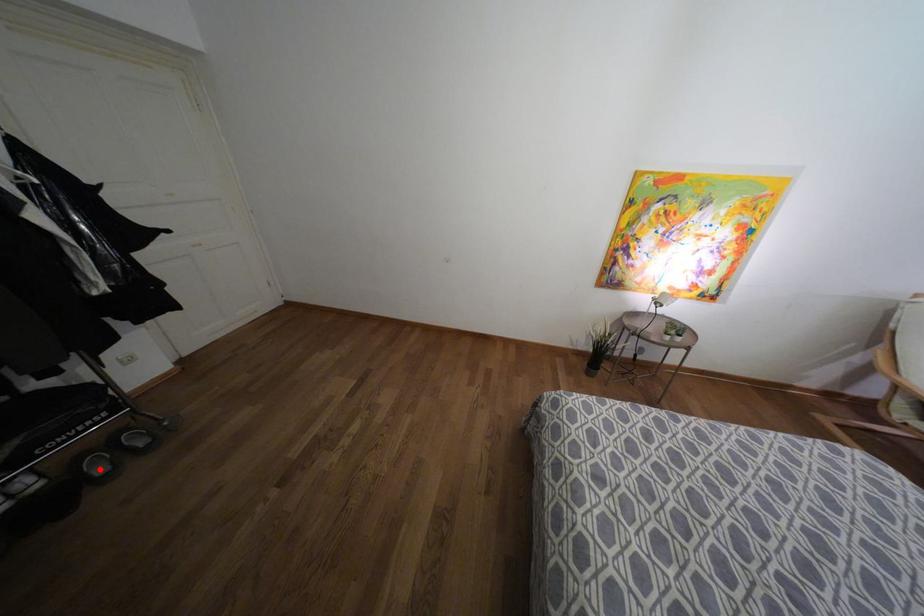
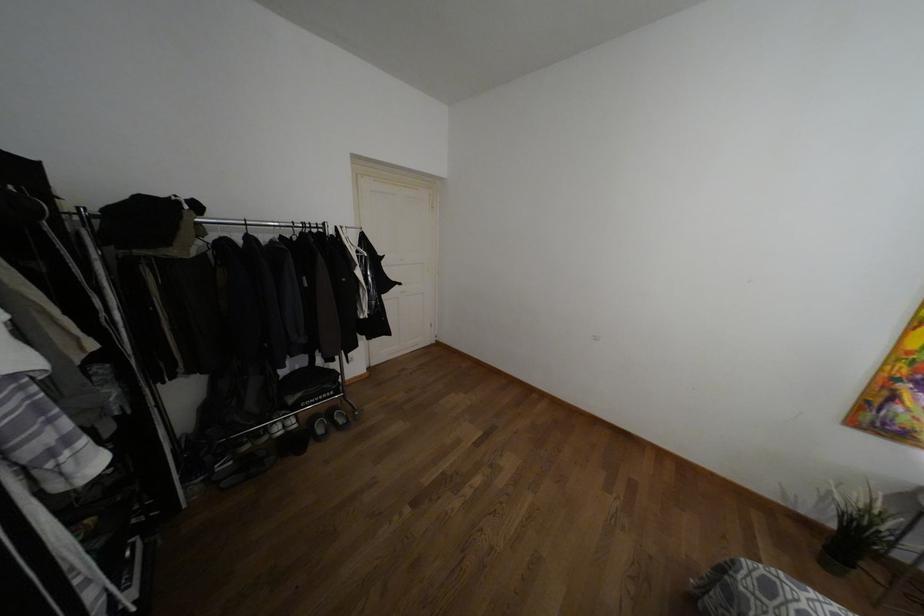
Where in the second image is the point corresponding to the highlighted location from the first image?

(320, 430)